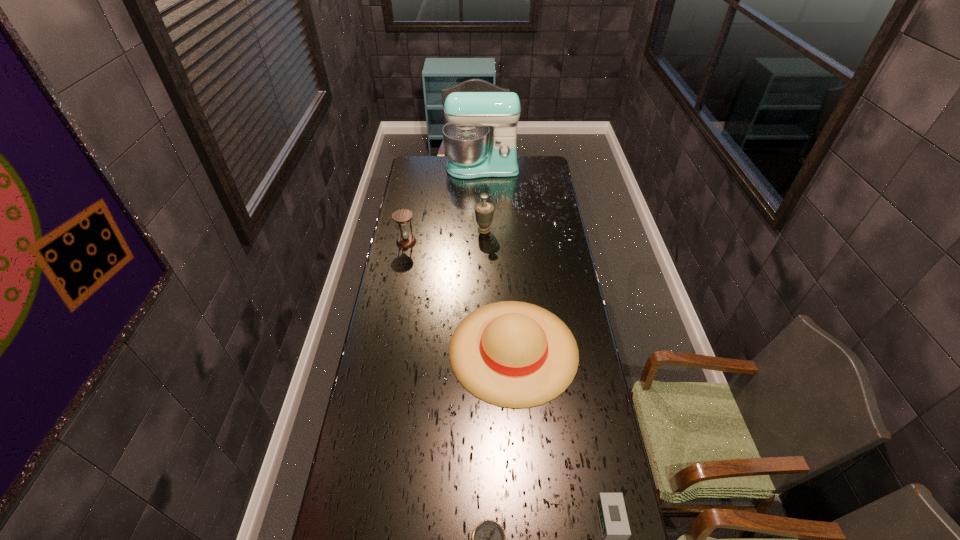
The image size is (960, 540). In order to click on object that is at the left edge in this screenshot , I will do `click(403, 216)`.

Locate an element on the screen. Image resolution: width=960 pixels, height=540 pixels. object situated at the right edge is located at coordinates (512, 354).

In the image, there is a desktop. In order to click on vacant space at the left edge in this screenshot , I will do `click(401, 201)`.

The width and height of the screenshot is (960, 540). In the image, there is a desktop. In order to click on free region at the right edge in this screenshot , I will do `click(546, 179)`.

In order to click on vacant area at the far right corner of the desktop in this screenshot , I will do (x=548, y=173).

Where is `free spot between the urn and the sombrero`? The width and height of the screenshot is (960, 540). free spot between the urn and the sombrero is located at coordinates (499, 290).

The width and height of the screenshot is (960, 540). In order to click on free area in between the fourth farthest object and the tallest object in this screenshot , I will do 497,259.

At what (x,y) coordinates should I click in order to perform the action: click on vacant space in between the third nearest object and the mixer. Please return your answer as a coordinate pair (x, y). This screenshot has height=540, width=960. Looking at the image, I should click on (497, 259).

Locate an element on the screen. object that is the fourth nearest to the fifth tallest object is located at coordinates (403, 216).

I want to click on the closest object to the compass, so point(613,520).